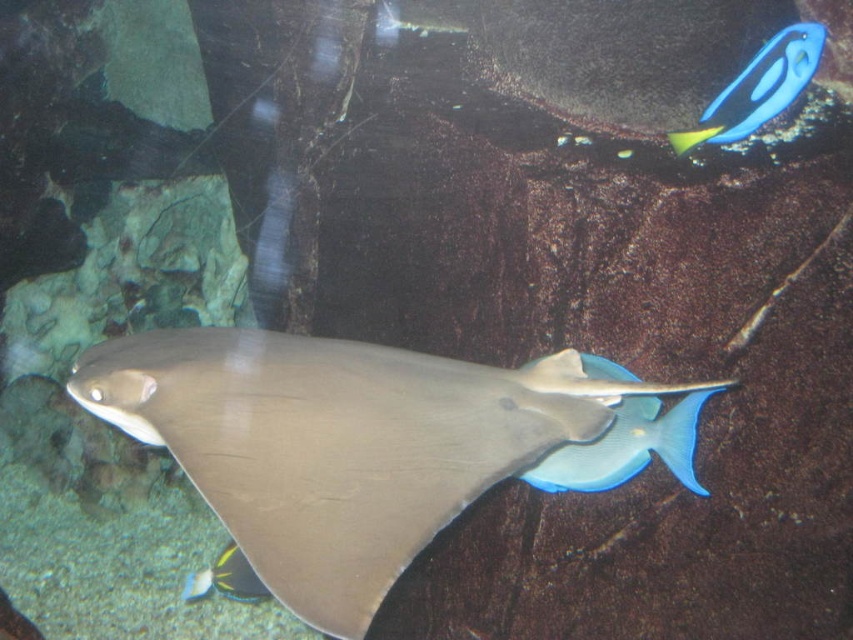
Question: Can you confirm if blue glossy fish at center is positioned below shiny blue fish at lower left?

Choices:
 (A) no
 (B) yes

Answer: (A)

Question: Which of the following is the closest to the observer?

Choices:
 (A) (238, 464)
 (B) (254, 595)
 (C) (766, 97)
 (D) (537, 481)

Answer: (A)

Question: Estimate the real-world distances between objects in this image. Which object is closer to the blue glossy fish at center?

Choices:
 (A) smooth gray stingray at center
 (B) shiny blue fish at lower left

Answer: (A)

Question: Which object is the closest to the blue glossy fish at center?

Choices:
 (A) smooth gray stingray at center
 (B) shiny blue fish at lower left

Answer: (A)

Question: From the image, what is the correct spatial relationship of smooth gray stingray at center in relation to blue glossy fish at upper right?

Choices:
 (A) above
 (B) below

Answer: (B)

Question: Does blue glossy fish at upper right appear on the right side of shiny blue fish at lower left?

Choices:
 (A) yes
 (B) no

Answer: (A)